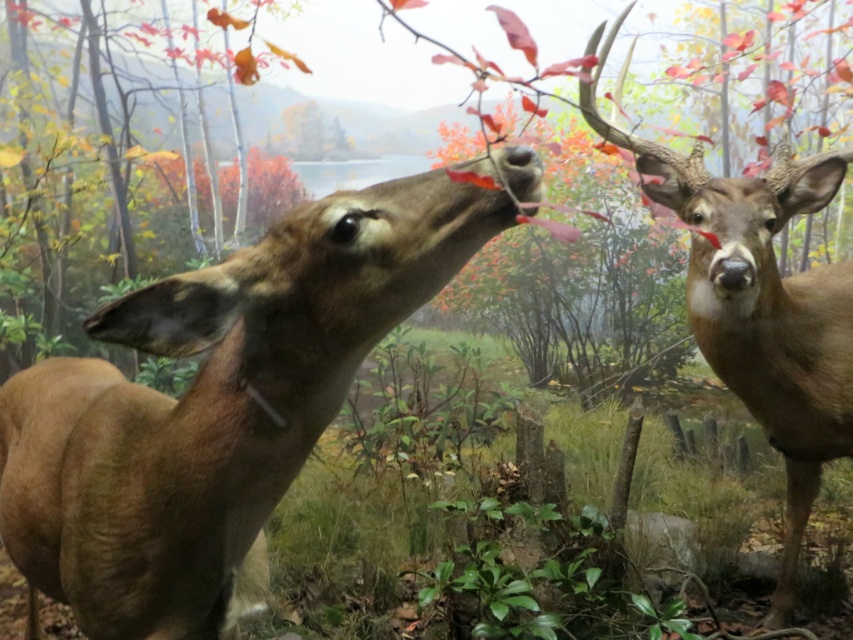
Question: Is brown matte/deer at left further to the viewer compared to brown velvet antlered deer at center?

Choices:
 (A) yes
 (B) no

Answer: (B)

Question: Does brown matte/deer at left have a lesser width compared to brown velvet antlered deer at center?

Choices:
 (A) yes
 (B) no

Answer: (B)

Question: Is brown matte/deer at left thinner than brown velvet antlered deer at center?

Choices:
 (A) yes
 (B) no

Answer: (B)

Question: Which point appears closest to the camera in this image?

Choices:
 (A) (744, 317)
 (B) (396, 244)

Answer: (B)